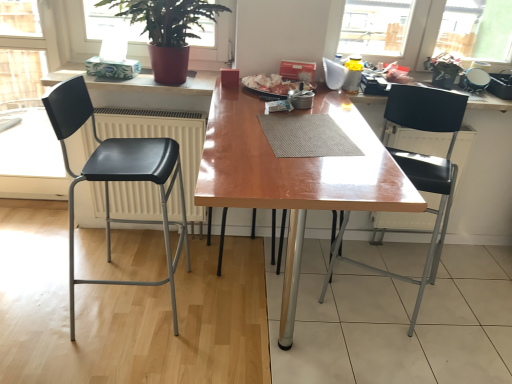
Measure the distance between point (117, 79) and camera.

They are 2.11 meters apart.

Describe the element at coordinates (295, 176) in the screenshot. I see `wooden table at center` at that location.

How much space does black matte chair at left, marked as the 2th chair in a right-to-left arrangement, occupy horizontally?

47.46 centimeters.

You are a GUI agent. You are given a task and a screenshot of the screen. Output one action in this format:
    pyautogui.click(x=<x>, y=<y>)
    Task: Click on the matte plastic counter top at upper left
    
    Given the screenshot: What is the action you would take?
    click(138, 81)

Is point (64, 124) in front of point (214, 83)?

Yes, point (64, 124) is in front of point (214, 83).

In the scene shown: Is the surface of black matte chair at left, marked as the 2th chair in a right-to-left arrangement, in direct contact with matte plastic counter top at upper left?

No, black matte chair at left, marked as the 2th chair in a right-to-left arrangement, is not in contact with matte plastic counter top at upper left.

From the picture: How much distance is there between black matte chair at left, marked as the 2th chair in a right-to-left arrangement, and matte plastic counter top at upper left?

black matte chair at left, marked as the 2th chair in a right-to-left arrangement, and matte plastic counter top at upper left are 20.79 inches apart from each other.

From the image's perspective, which one is positioned lower, black matte chair at left, marked as the 2th chair in a right-to-left arrangement, or matte plastic counter top at upper left?

black matte chair at left, marked as the 2th chair in a right-to-left arrangement.

Is point (182, 12) less distant than point (289, 338)?

No, it is behind (289, 338).

In the scene shown: Is matte red pot at upper left wider than wooden table at center?

In fact, matte red pot at upper left might be narrower than wooden table at center.

Is the surface of matte red pot at upper left in direct contact with wooden table at center?

matte red pot at upper left and wooden table at center are not in contact.

Is matte red pot at upper left taller than wooden table at center?

In fact, matte red pot at upper left may be shorter than wooden table at center.

Are black matte chair at left, which is counted as the 1th chair, starting from the left, and matte red pot at upper left making contact?

No, black matte chair at left, which is counted as the 1th chair, starting from the left, is not touching matte red pot at upper left.

Based on the photo, does black matte chair at left, marked as the 2th chair in a right-to-left arrangement, have a larger size compared to matte red pot at upper left?

Yes, black matte chair at left, marked as the 2th chair in a right-to-left arrangement, is bigger than matte red pot at upper left.

I want to click on houseplant behind the black matte chair at left, marked as the 2th chair in a right-to-left arrangement, so click(167, 31).

Is black plastic chair at right, marked as the 1th chair in a right-to-left arrangement, situated inside black matte chair at left, which is counted as the 1th chair, starting from the left, or outside?

black plastic chair at right, marked as the 1th chair in a right-to-left arrangement, cannot be found inside black matte chair at left, which is counted as the 1th chair, starting from the left.

From a real-world perspective, between black plastic chair at right, marked as the 1th chair in a right-to-left arrangement, and black matte chair at left, which is counted as the 1th chair, starting from the left, who is vertically higher?

In real-world perspective, black plastic chair at right, marked as the 1th chair in a right-to-left arrangement, is above.

Is point (455, 127) closer or farther from the camera than point (68, 167)?

Point (455, 127) appears to be closer to the viewer than point (68, 167).

Considering the sizes of black plastic chair at right, which is the 2th chair in left-to-right order, and matte plastic counter top at upper left in the image, is black plastic chair at right, which is the 2th chair in left-to-right order, wider or thinner than matte plastic counter top at upper left?

black plastic chair at right, which is the 2th chair in left-to-right order, is wider than matte plastic counter top at upper left.

From the image's perspective, would you say black plastic chair at right, which is the 2th chair in left-to-right order, is shown under matte plastic counter top at upper left?

Yes.

Considering the sizes of black plastic chair at right, marked as the 1th chair in a right-to-left arrangement, and matte plastic counter top at upper left in the image, is black plastic chair at right, marked as the 1th chair in a right-to-left arrangement, bigger or smaller than matte plastic counter top at upper left?

black plastic chair at right, marked as the 1th chair in a right-to-left arrangement, is bigger than matte plastic counter top at upper left.

Is the depth of black plastic chair at right, marked as the 1th chair in a right-to-left arrangement, greater than that of matte red pot at upper left?

No, black plastic chair at right, marked as the 1th chair in a right-to-left arrangement, is closer to the camera.

Is black plastic chair at right, marked as the 1th chair in a right-to-left arrangement, taller than matte red pot at upper left?

Indeed, black plastic chair at right, marked as the 1th chair in a right-to-left arrangement, has a greater height compared to matte red pot at upper left.

Between black plastic chair at right, which is the 2th chair in left-to-right order, and matte red pot at upper left, which one has larger size?

Bigger between the two is black plastic chair at right, which is the 2th chair in left-to-right order.

From a real-world perspective, is black plastic chair at right, marked as the 1th chair in a right-to-left arrangement, located beneath matte red pot at upper left?

Yes.

Can black plastic chair at right, marked as the 1th chair in a right-to-left arrangement, be found inside matte red pot at upper left?

Definitely not — black plastic chair at right, marked as the 1th chair in a right-to-left arrangement, is not inside matte red pot at upper left.

Considering the sizes of objects matte red pot at upper left and black plastic chair at right, marked as the 1th chair in a right-to-left arrangement, in the image provided, who is bigger, matte red pot at upper left or black plastic chair at right, marked as the 1th chair in a right-to-left arrangement,?

With larger size is black plastic chair at right, marked as the 1th chair in a right-to-left arrangement.

Considering their positions, is matte red pot at upper left located in front of or behind black plastic chair at right, which is the 2th chair in left-to-right order?

matte red pot at upper left is behind black plastic chair at right, which is the 2th chair in left-to-right order.

Is matte red pot at upper left to the left or to the right of black plastic chair at right, which is the 2th chair in left-to-right order, in the image?

matte red pot at upper left is to the left of black plastic chair at right, which is the 2th chair in left-to-right order.

This screenshot has height=384, width=512. In order to click on counter top located behind the black matte chair at left, which is counted as the 1th chair, starting from the left in this screenshot , I will do `click(138, 81)`.

In the image, there is a matte red pot at upper left. Where is `desk below it (from the image's perspective)`? This screenshot has height=384, width=512. desk below it (from the image's perspective) is located at coordinates (295, 176).

From the image, which object appears to be nearer to matte red pot at upper left, wooden table at center or matte plastic counter top at upper left?

matte plastic counter top at upper left is positioned closer to the anchor matte red pot at upper left.

Looking at the image, which one is located closer to matte plastic counter top at upper left, matte red pot at upper left or black matte chair at left, marked as the 2th chair in a right-to-left arrangement?

matte red pot at upper left is positioned closer to the anchor matte plastic counter top at upper left.

When comparing their distances from black plastic chair at right, marked as the 1th chair in a right-to-left arrangement, does matte plastic counter top at upper left or wooden table at center seem further?

matte plastic counter top at upper left is further to black plastic chair at right, marked as the 1th chair in a right-to-left arrangement.

When comparing their distances from matte plastic counter top at upper left, does wooden table at center or black plastic chair at right, which is the 2th chair in left-to-right order, seem further?

The object further to matte plastic counter top at upper left is black plastic chair at right, which is the 2th chair in left-to-right order.

From the picture: When comparing their distances from black matte chair at left, marked as the 2th chair in a right-to-left arrangement, does black plastic chair at right, marked as the 1th chair in a right-to-left arrangement, or matte plastic counter top at upper left seem further?

Among the two, black plastic chair at right, marked as the 1th chair in a right-to-left arrangement, is located further to black matte chair at left, marked as the 2th chair in a right-to-left arrangement.

Looking at the image, which one is located further to matte red pot at upper left, matte plastic counter top at upper left or wooden table at center?

wooden table at center is further to matte red pot at upper left.

Based on their spatial positions, is black matte chair at left, which is counted as the 1th chair, starting from the left, or matte red pot at upper left closer to black plastic chair at right, marked as the 1th chair in a right-to-left arrangement?

black matte chair at left, which is counted as the 1th chair, starting from the left, is positioned closer to the anchor black plastic chair at right, marked as the 1th chair in a right-to-left arrangement.

Which object lies nearer to the anchor point black plastic chair at right, which is the 2th chair in left-to-right order, wooden table at center or matte plastic counter top at upper left?

wooden table at center is closer to black plastic chair at right, which is the 2th chair in left-to-right order.

The image size is (512, 384). What are the coordinates of `counter top that lies between matte red pot at upper left and wooden table at center from top to bottom` in the screenshot? It's located at (138, 81).

Locate an element on the screen. houseplant situated between matte plastic counter top at upper left and black plastic chair at right, which is the 2th chair in left-to-right order, from left to right is located at coordinates 167,31.

Where is `counter top between matte red pot at upper left and black matte chair at left, marked as the 2th chair in a right-to-left arrangement, in the vertical direction`? This screenshot has width=512, height=384. counter top between matte red pot at upper left and black matte chair at left, marked as the 2th chair in a right-to-left arrangement, in the vertical direction is located at coordinates (138, 81).

Locate an element on the screen. The width and height of the screenshot is (512, 384). desk between black matte chair at left, which is counted as the 1th chair, starting from the left, and black plastic chair at right, marked as the 1th chair in a right-to-left arrangement, in the horizontal direction is located at coordinates (295, 176).